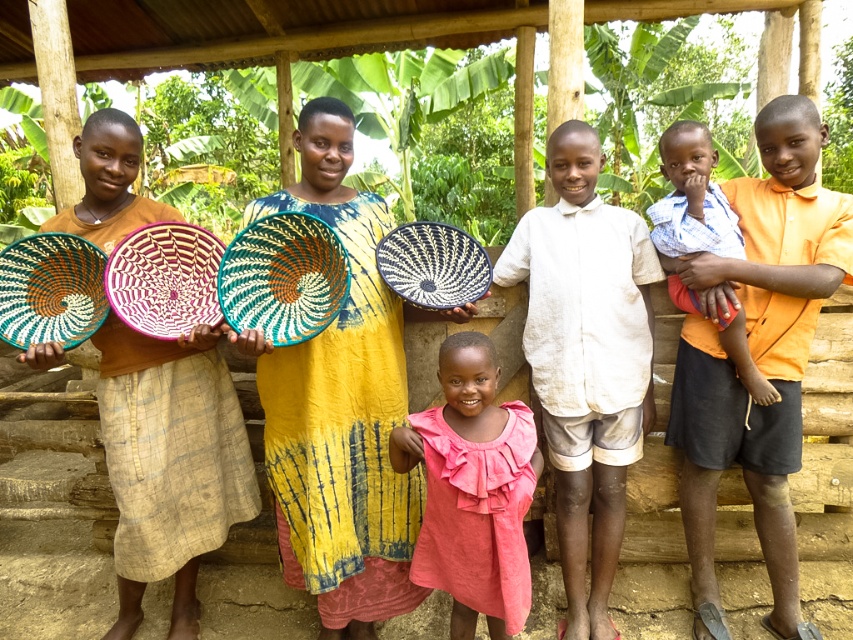
Can you confirm if white cotton shirt at center is positioned to the right of blue plaid shirt at center?

Incorrect, white cotton shirt at center is not on the right side of blue plaid shirt at center.

Is point (558, 333) positioned behind point (704, 236)?

Yes, point (558, 333) is behind point (704, 236).

Between point (622, 428) and point (688, 180), which one is positioned behind?

Point (622, 428)

Identify the location of white cotton shirt at center. (585, 358).

Who is more forward, (155, 362) or (695, 147)?

Positioned in front is point (695, 147).

Does multicolored woven baskets at left have a greater width compared to blue plaid shirt at center?

Yes.

Locate an element on the screen. The width and height of the screenshot is (853, 640). multicolored woven baskets at left is located at coordinates (169, 461).

Locate an element on the screen. multicolored woven baskets at left is located at coordinates (169, 461).

Is pink cotton dress at center smaller than black woven basket at center?

Actually, pink cotton dress at center might be larger than black woven basket at center.

Does point (489, 340) come behind point (436, 284)?

That is False.

The height and width of the screenshot is (640, 853). Describe the element at coordinates (473, 490) in the screenshot. I see `pink cotton dress at center` at that location.

I want to click on pink cotton dress at center, so click(473, 490).